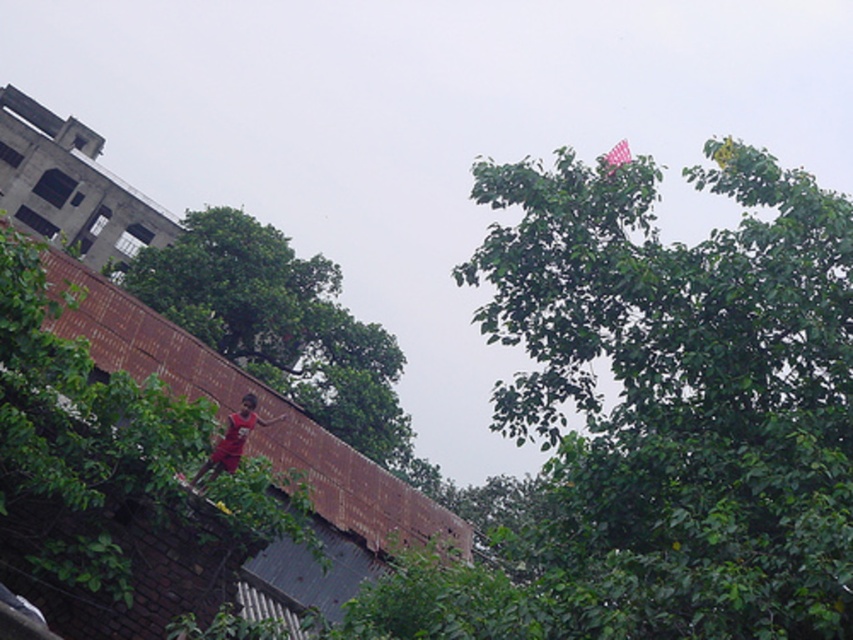
Is point (224, 460) in front of point (614, 161)?

No, (224, 460) is behind (614, 161).

Who is more forward, (215, 451) or (621, 144)?

Positioned in front is point (621, 144).

At what (x,y) coordinates should I click in order to perform the action: click on red fabric person at center. Please return your answer as a coordinate pair (x, y). The height and width of the screenshot is (640, 853). Looking at the image, I should click on (233, 438).

Between green leafy tree at center and pink fabric kite at upper right, which one appears on the right side from the viewer's perspective?

From the viewer's perspective, pink fabric kite at upper right appears more on the right side.

Locate an element on the screen. Image resolution: width=853 pixels, height=640 pixels. green leafy tree at center is located at coordinates (277, 324).

Identify the location of green leafy tree at center. coord(277,324).

Can you confirm if green leafy tree at center is positioned to the left of brown brick wall at upper left?

Indeed, green leafy tree at center is positioned on the left side of brown brick wall at upper left.

Does point (198, 336) come behind point (404, 499)?

Yes, it is.

Identify the location of green leafy tree at center. (277, 324).